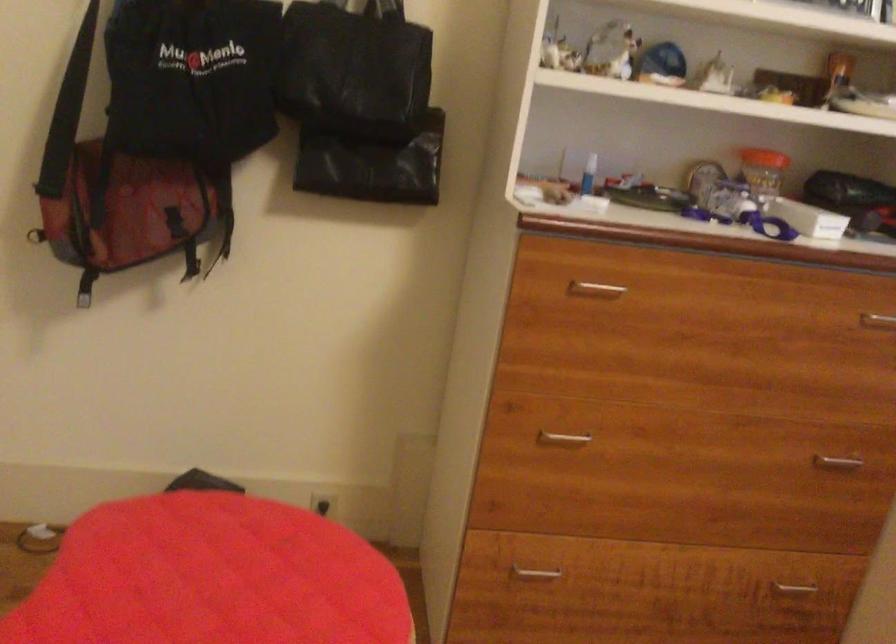
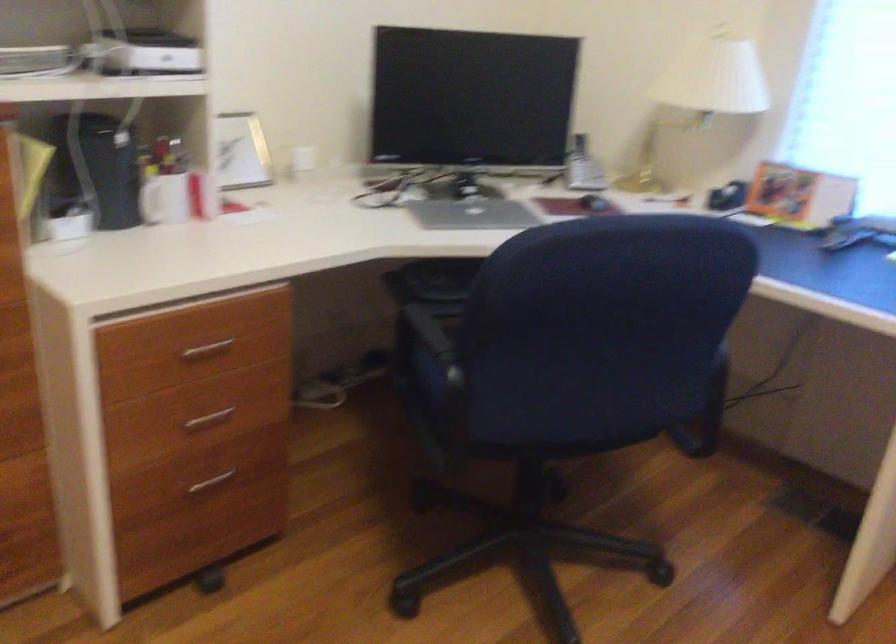
Question: The images are taken continuously from a first-person perspective. In which direction is your viewpoint rotating?

Choices:
 (A) Left
 (B) Right
 (C) Up
 (D) Down

Answer: (B)